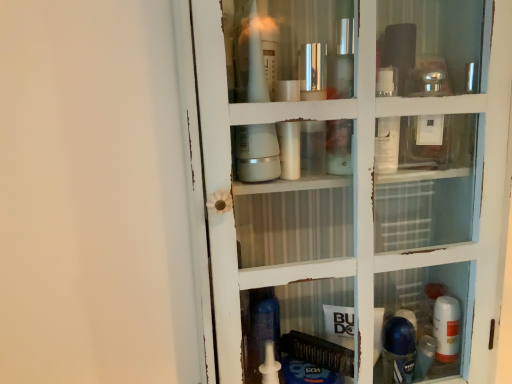
What do you see at coordinates (349, 182) in the screenshot? I see `clear glass cabinet at center` at bounding box center [349, 182].

Image resolution: width=512 pixels, height=384 pixels. What are the coordinates of `clear glass cabinet at center` in the screenshot? It's located at (349, 182).

At what (x,y) coordinates should I click in order to perform the action: click on clear glass cabinet at center. Please return your answer as a coordinate pair (x, y). Looking at the image, I should click on (349, 182).